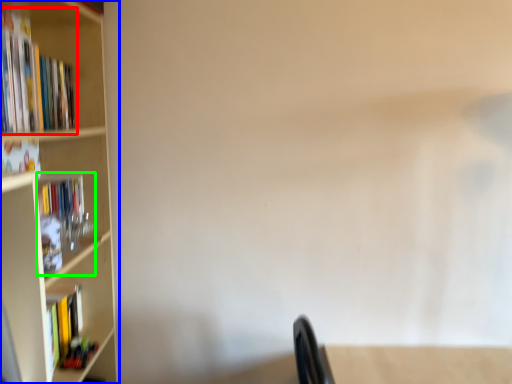
Question: Which object is the closest to the book (highlighted by a red box)? Choose among these: bookcase (highlighted by a blue box) or book (highlighted by a green box).

Choices:
 (A) bookcase
 (B) book

Answer: (A)